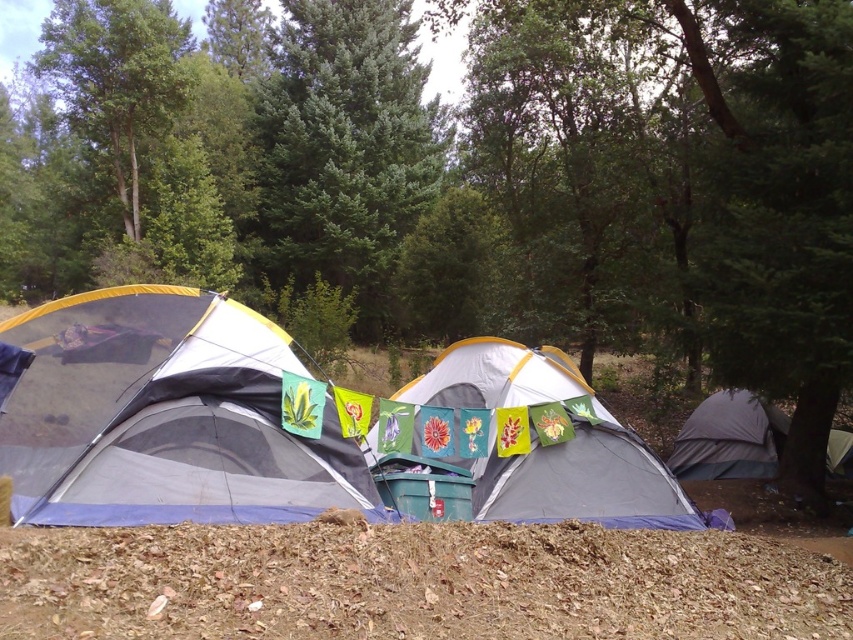
Does gray fabric tent at center lie behind gray fabric tent at right?

No, gray fabric tent at center is closer to the viewer.

Is gray fabric tent at center closer to the viewer compared to gray fabric tent at right?

Yes, it is in front of gray fabric tent at right.

Is point (462, 387) less distant than point (767, 420)?

Yes, point (462, 387) is in front of point (767, 420).

Find the location of a particular element. Image resolution: width=853 pixels, height=640 pixels. gray fabric tent at center is located at coordinates (553, 444).

What do you see at coordinates (415, 582) in the screenshot? The width and height of the screenshot is (853, 640). I see `brown dry leaves at lower center` at bounding box center [415, 582].

Find the location of a particular element. brown dry leaves at lower center is located at coordinates (415, 582).

Measure the distance from matte gray tent at left to gray fabric tent at center.

They are 2.51 meters apart.

Who is more forward, (128, 362) or (483, 340)?

Point (128, 362) is in front.

Is point (0, 435) more distant than point (490, 340)?

That is False.

This screenshot has height=640, width=853. Find the location of `matte gray tent at left`. matte gray tent at left is located at coordinates point(165,417).